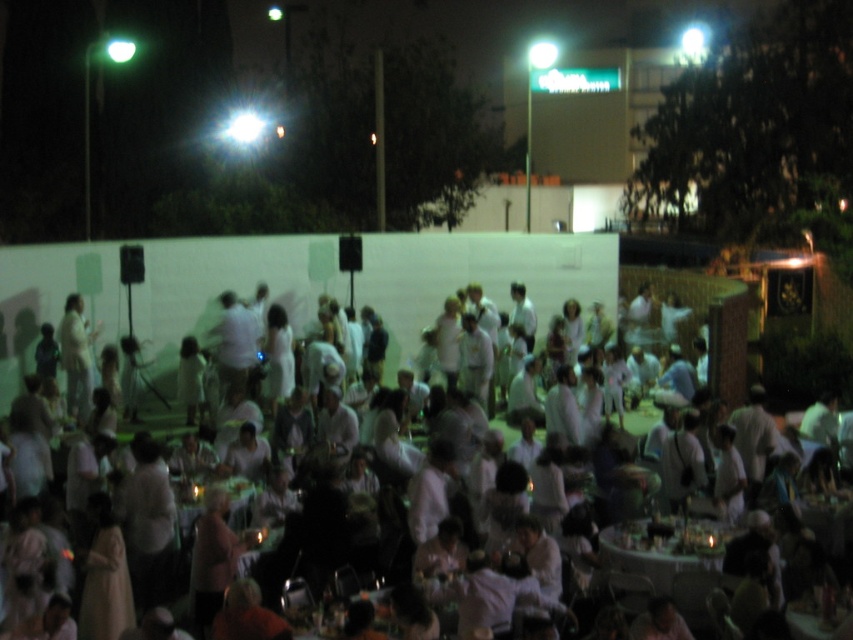
Describe the element at coordinates (20, 316) in the screenshot. Image resolution: width=853 pixels, height=640 pixels. I see `white matte dress at center` at that location.

Who is shorter, white matte dress at center or wooden round table at center?

With less height is wooden round table at center.

You are a GUI agent. You are given a task and a screenshot of the screen. Output one action in this format:
    pyautogui.click(x=<x>, y=<y>)
    Task: Click on the white matte dress at center
    This screenshot has height=640, width=853.
    Given the screenshot: What is the action you would take?
    pyautogui.click(x=20, y=316)